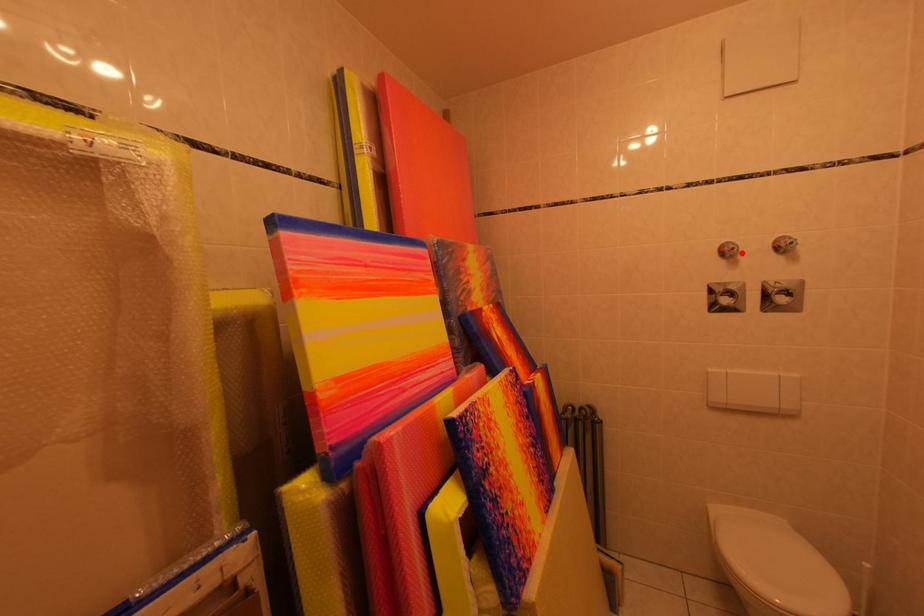
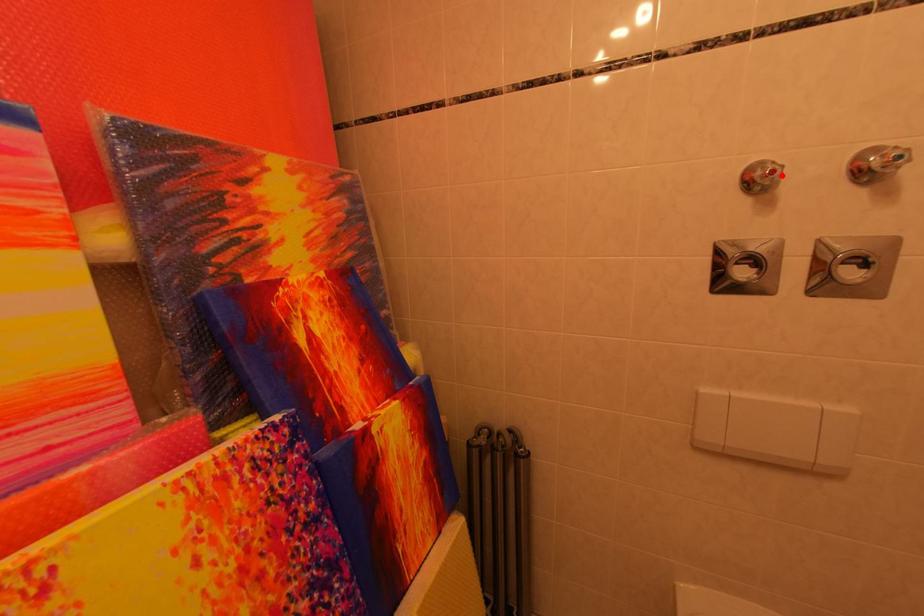
I am providing you with two images of the same scene from different viewpoints. A red point is marked on the first image and another point is marked on the second image. Is the red point in image1 aligned with the point shown in image2?

Yes